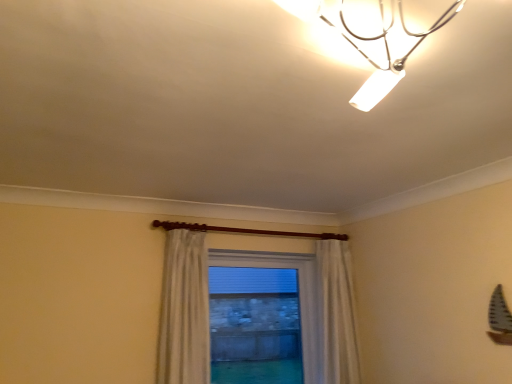
Image resolution: width=512 pixels, height=384 pixels. What do you see at coordinates (184, 310) in the screenshot?
I see `white sheer curtain at center` at bounding box center [184, 310].

Identify the location of metallic chrome lamp at upper center. The width and height of the screenshot is (512, 384). (372, 38).

Between metallic chrome lamp at upper center and clear glass window at center, which one appears on the right side from the viewer's perspective?

Positioned to the right is metallic chrome lamp at upper center.

Based on the photo, from the image's perspective, is metallic chrome lamp at upper center below clear glass window at center?

No, from the image's perspective, metallic chrome lamp at upper center is not beneath clear glass window at center.

Considering the positions of objects metallic chrome lamp at upper center and clear glass window at center in the image provided, who is behind, metallic chrome lamp at upper center or clear glass window at center?

clear glass window at center is behind.

Between metallic chrome lamp at upper center and clear glass window at center, which one has more height?

With more height is clear glass window at center.

Which is less distant, (159, 343) or (350, 100)?

The point (350, 100) is closer to the camera.

How many degrees apart are the facing directions of white sheer curtain at center and metallic chrome lamp at upper center?

The angle between the facing direction of white sheer curtain at center and the facing direction of metallic chrome lamp at upper center is 2.43 degrees.

Which is behind, white sheer curtain at center or metallic chrome lamp at upper center?

white sheer curtain at center.

From the picture: From the image's perspective, which object appears higher, metallic chrome lamp at upper center or white sheer curtain at center?

From the image's view, metallic chrome lamp at upper center is above.

Between metallic chrome lamp at upper center and white sheer curtain at center, which one has larger width?

metallic chrome lamp at upper center is wider.

Between point (300, 17) and point (159, 370), which one is positioned behind?

Point (159, 370)

Which object is closer to the camera taking this photo, metallic chrome lamp at upper center or white sheer curtain at center?

Positioned in front is metallic chrome lamp at upper center.

Is metallic chrome lamp at upper center completely or partially inside clear glass window at center?

That's incorrect, metallic chrome lamp at upper center is not inside clear glass window at center.

How many degrees apart are the facing directions of clear glass window at center and metallic chrome lamp at upper center?

They differ by 2.44 degrees in their facing directions.

Considering the positions of objects clear glass window at center and metallic chrome lamp at upper center in the image provided, who is behind, clear glass window at center or metallic chrome lamp at upper center?

Positioned behind is clear glass window at center.

From the image's perspective, would you say clear glass window at center is shown under metallic chrome lamp at upper center?

Yes, from the image's perspective, clear glass window at center is beneath metallic chrome lamp at upper center.

Image resolution: width=512 pixels, height=384 pixels. Identify the location of window behind the white sheer curtain at center. (262, 317).

Consider the image. How much distance is there between clear glass window at center and white sheer curtain at center?

clear glass window at center and white sheer curtain at center are 2.17 meters apart.

Is point (237, 328) closer or farther from the camera than point (198, 345)?

Point (237, 328) is farther from the camera than point (198, 345).

Is clear glass window at center not within white sheer curtain at center?

Yes, clear glass window at center is not within white sheer curtain at center.

Is white sheer curtain at center behind clear glass window at center?

That is False.

Considering the sizes of objects white sheer curtain at center and clear glass window at center in the image provided, who is bigger, white sheer curtain at center or clear glass window at center?

With larger size is clear glass window at center.

From a real-world perspective, is white sheer curtain at center located higher than clear glass window at center?

Yes, from a real-world perspective, white sheer curtain at center is over clear glass window at center

Does point (204, 371) come behind point (269, 282)?

That is False.

The height and width of the screenshot is (384, 512). What are the coordinates of `lamp located above the clear glass window at center (from a real-world perspective)` in the screenshot? It's located at (372, 38).

Where is `lamp above the white sheer curtain at center (from the image's perspective)`? lamp above the white sheer curtain at center (from the image's perspective) is located at coordinates (372, 38).

Based on the photo, considering their positions, is clear glass window at center positioned further to metallic chrome lamp at upper center than white sheer curtain at center?

clear glass window at center.

Consider the image. Which object lies further to the anchor point white sheer curtain at center, clear glass window at center or metallic chrome lamp at upper center?

Among the two, clear glass window at center is located further to white sheer curtain at center.

From the image, which object appears to be farther from clear glass window at center, metallic chrome lamp at upper center or white sheer curtain at center?

The object further to clear glass window at center is metallic chrome lamp at upper center.

From the image, which object appears to be farther from white sheer curtain at center, metallic chrome lamp at upper center or clear glass window at center?

clear glass window at center is further to white sheer curtain at center.

Estimate the real-world distances between objects in this image. Which object is closer to metallic chrome lamp at upper center, white sheer curtain at center or clear glass window at center?

Based on the image, white sheer curtain at center appears to be nearer to metallic chrome lamp at upper center.

Based on their spatial positions, is white sheer curtain at center or metallic chrome lamp at upper center further from clear glass window at center?

metallic chrome lamp at upper center is further to clear glass window at center.

Locate an element on the screen. curtain located between metallic chrome lamp at upper center and clear glass window at center in the depth direction is located at coordinates (184, 310).